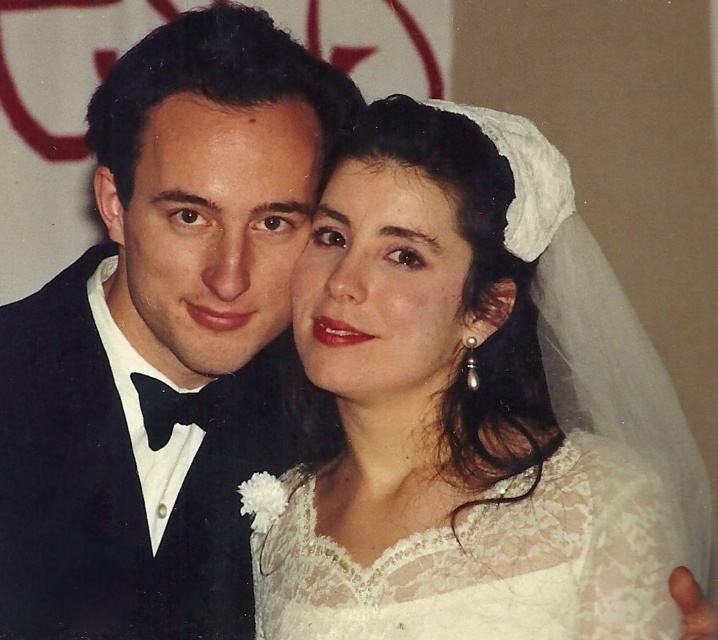
You are standing in front of the wedding couple and want to take a photo. If you move forward 2 feet towards the point at point (37, 424), how far will you be from the point?

The point at point (37, 424) and viewer are 3.52 feet apart. If you move forward 2 feet towards it, you will be 1.52 feet away from the point.

You are a photographer setting up for a formal portrait. You have a black satin tuxedo at left and a white lace dress at center in your frame. Which clothing item is taller in the image?

The black satin tuxedo at left is taller than the white lace dress at center.

You are a photographer setting up for a wedding photo shoot. You have to ensure that both the white lace veil at upper center and the white lace dress at center are visible in the frame. Given that the veil is larger, which object might require more space in the composition to capture fully?

The white lace veil at upper center requires more space in the composition since it is larger in size than the white lace dress at center.